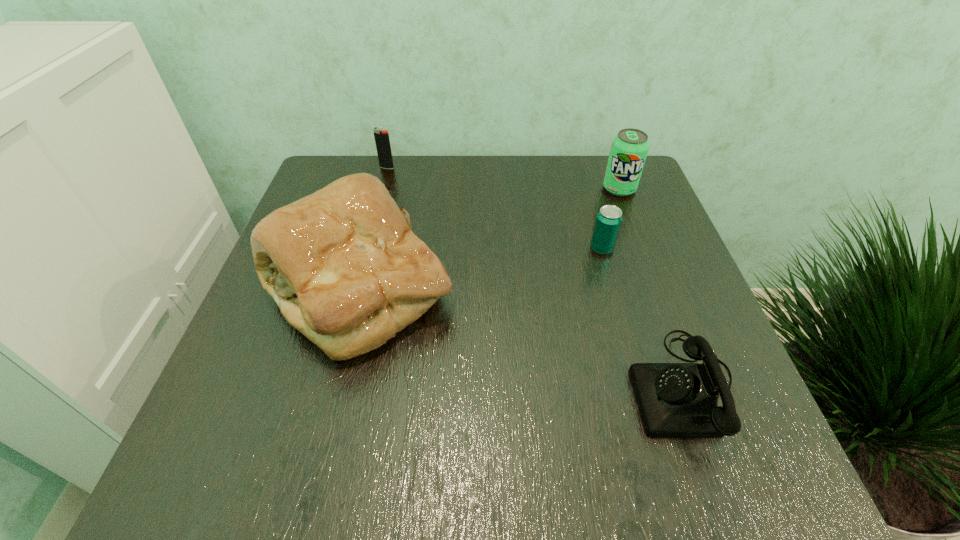
Locate an element on the screen. This screenshot has width=960, height=540. blank space located on the front face of the telephone is located at coordinates coord(438,386).

You are a GUI agent. You are given a task and a screenshot of the screen. Output one action in this format:
    pyautogui.click(x=<x>, y=<y>)
    Task: Click on the vacant region located on the front face of the telephone
    
    Given the screenshot: What is the action you would take?
    pyautogui.click(x=396, y=386)

You are a GUI agent. You are given a task and a screenshot of the screen. Output one action in this format:
    pyautogui.click(x=<x>, y=<y>)
    Task: Click on the vacant space located 0.200m on the front face of the telephone
    The image size is (960, 540).
    Given the screenshot: What is the action you would take?
    pyautogui.click(x=511, y=386)

This screenshot has height=540, width=960. In order to click on pop soda that is at the far edge in this screenshot , I will do `click(629, 148)`.

Locate an element on the screen. Image resolution: width=960 pixels, height=540 pixels. igniter at the far edge is located at coordinates click(x=382, y=141).

In order to click on object that is positioned at the near edge in this screenshot , I will do `click(675, 400)`.

Find the location of `bread located at the left edge`. bread located at the left edge is located at coordinates (343, 265).

Locate an element on the screen. igniter that is positioned at the left edge is located at coordinates (382, 141).

The width and height of the screenshot is (960, 540). I want to click on pop soda that is at the right edge, so click(x=629, y=148).

Find the location of `beer can located in the right edge section of the desktop`. beer can located in the right edge section of the desktop is located at coordinates (608, 221).